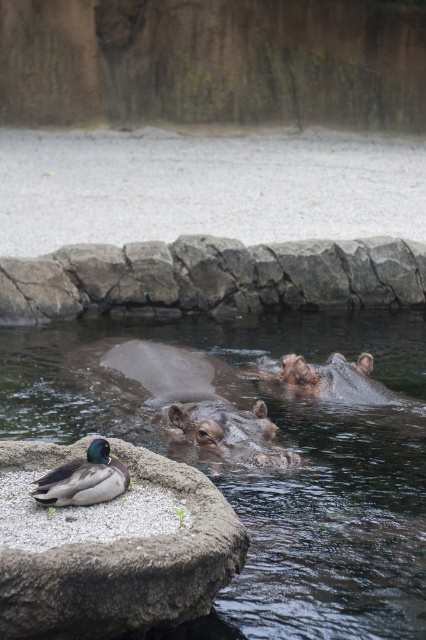
You are standing at the edge of the water and want to reach the gray rough stone at lower left. Which direction should you move relative to the hippos to get there?

The gray rough stone at lower left is located at point (126, 568), so you should move towards the lower left direction relative to the hippos to reach it.